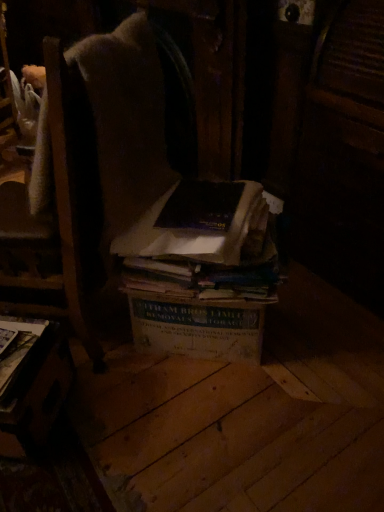
I want to click on free spot above wooden table at lower left (from a real-world perspective), so click(x=25, y=347).